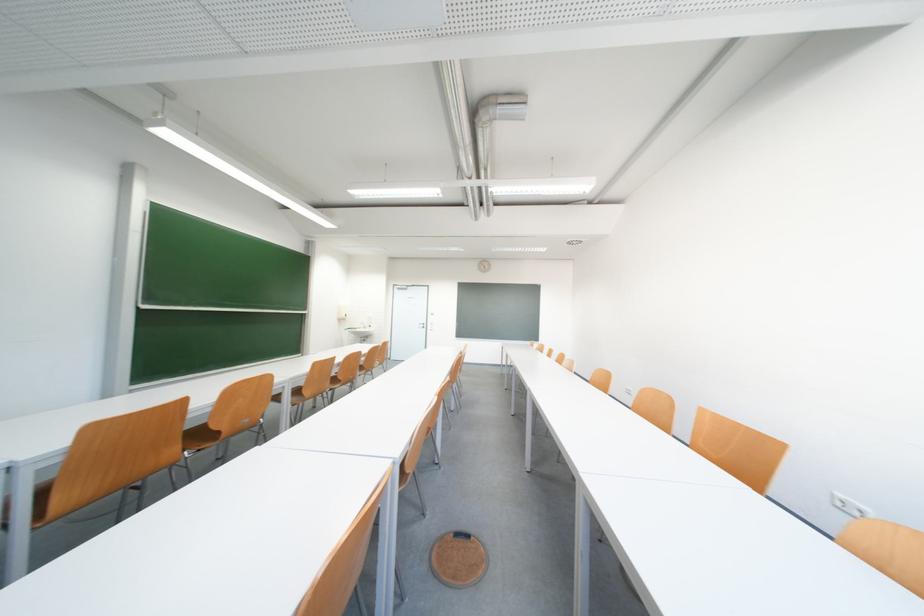
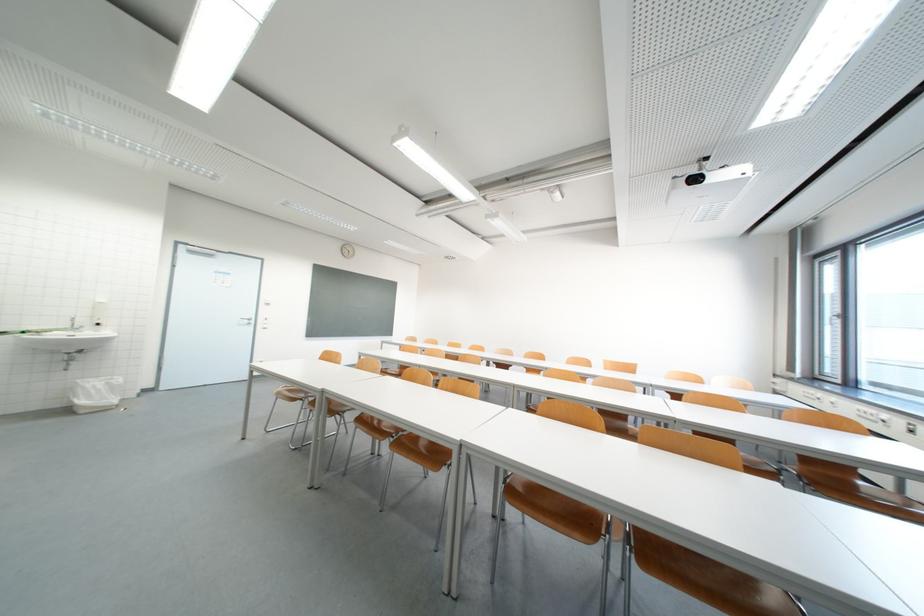
The point at (433, 328) is marked in the first image. Where is the corresponding point in the second image?

(261, 323)